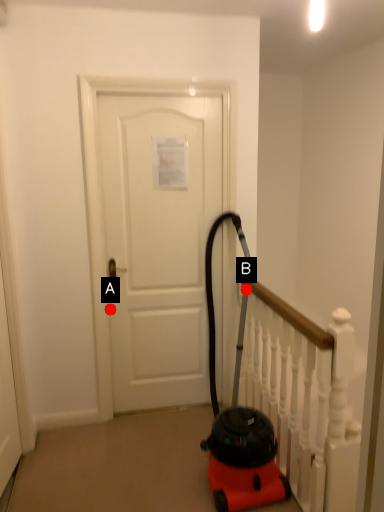
Question: Two points are circled on the image, labeled by A and B beside each circle. Which point appears closest to the camera in this image?

Choices:
 (A) A is closer
 (B) B is closer

Answer: (B)